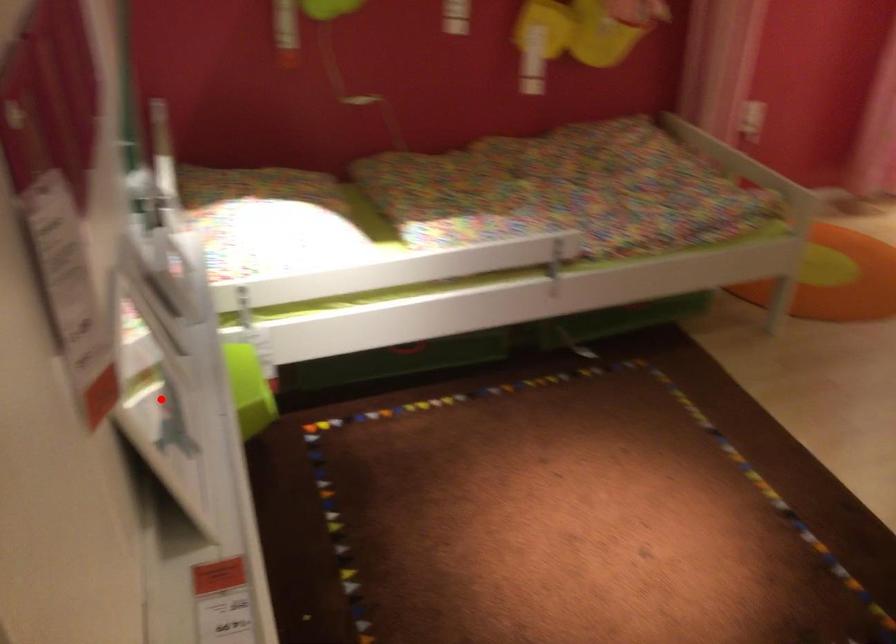
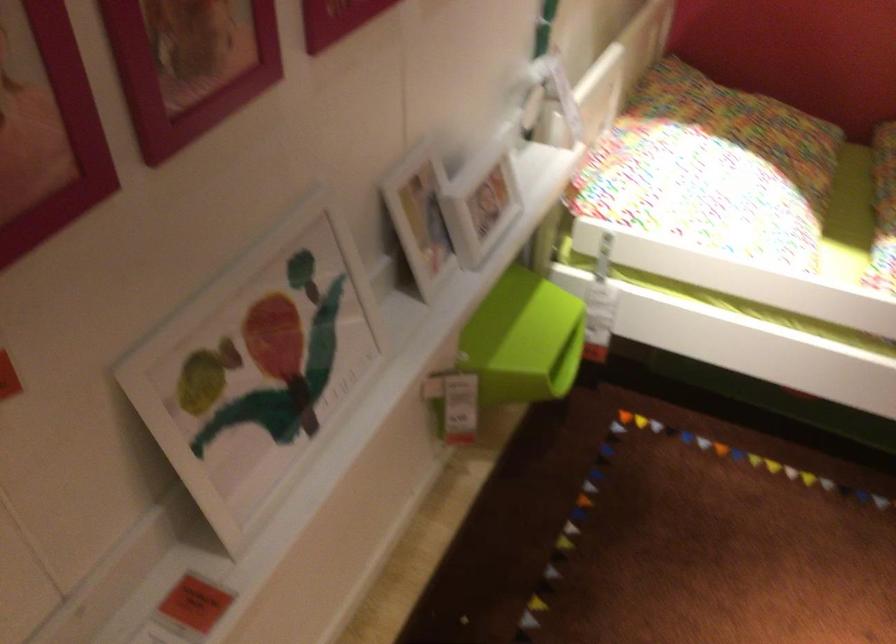
Where in the second image is the point corresponding to the highlighted location from the first image?

(257, 368)